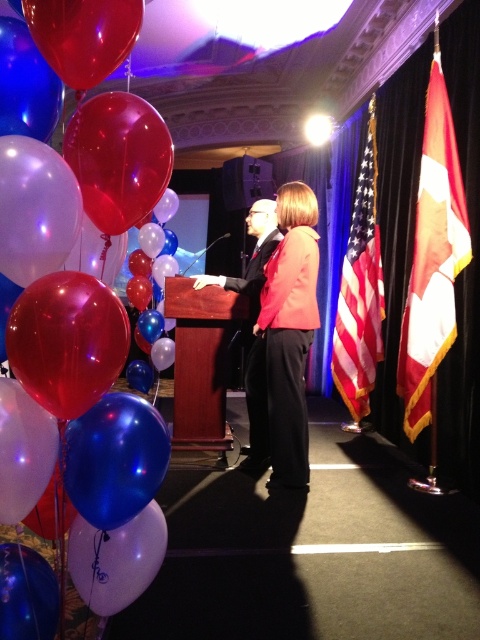
Is red and white fabric flag at right taller than matte black suit at center?

Yes, red and white fabric flag at right is taller than matte black suit at center.

Is point (455, 275) positioned behind point (245, 282)?

No, it is in front of (245, 282).

The height and width of the screenshot is (640, 480). I want to click on red and white fabric flag at right, so click(x=432, y=259).

What do you see at coordinates (432, 259) in the screenshot? Image resolution: width=480 pixels, height=640 pixels. I see `red and white fabric flag at right` at bounding box center [432, 259].

The image size is (480, 640). What are the coordinates of `red and white fabric flag at right` in the screenshot? It's located at (432, 259).

Is mahogany wood podium at center smaller than american flag at right?

Yes.

Does point (186, 340) come behind point (383, 316)?

No, it is not.

Between point (186, 348) and point (338, 326), which one is positioned in front?

Point (186, 348)

You are a GUI agent. You are given a task and a screenshot of the screen. Output one action in this format:
    pyautogui.click(x=<x>, y=<y>)
    Task: Click on the mahogany wood podium at center
    This screenshot has width=480, height=640.
    Given the screenshot: What is the action you would take?
    pyautogui.click(x=202, y=362)